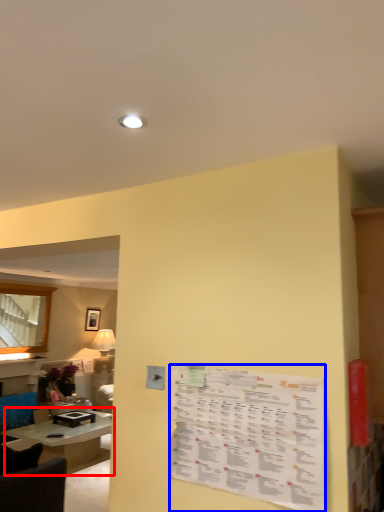
Question: Which object appears closest to the camera in this image, table (highlighted by a red box) or menu (highlighted by a blue box)?

Choices:
 (A) table
 (B) menu

Answer: (B)